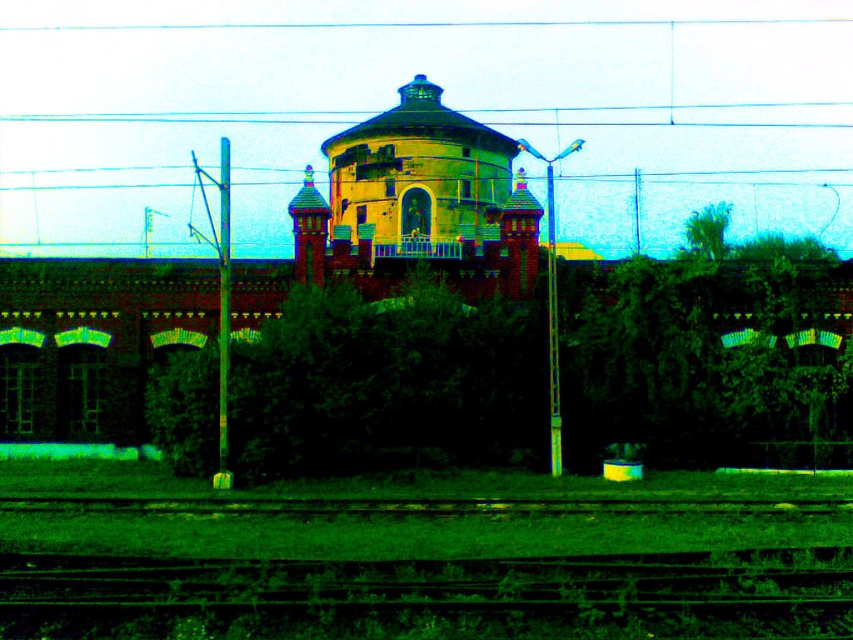
Question: Does green grassy train track at lower center appear on the right side of yellow brick water tower at center?

Choices:
 (A) yes
 (B) no

Answer: (A)

Question: Does green grassy train track at lower center appear on the left side of yellow brick water tower at center?

Choices:
 (A) yes
 (B) no

Answer: (B)

Question: Does green grassy train track at lower center appear over yellow brick water tower at center?

Choices:
 (A) yes
 (B) no

Answer: (B)

Question: Among these objects, which one is farthest from the camera?

Choices:
 (A) yellow brick water tower at center
 (B) green grassy train track at lower center

Answer: (A)

Question: Which object is farther from the camera taking this photo?

Choices:
 (A) green grassy train track at lower center
 (B) yellow brick water tower at center

Answer: (B)